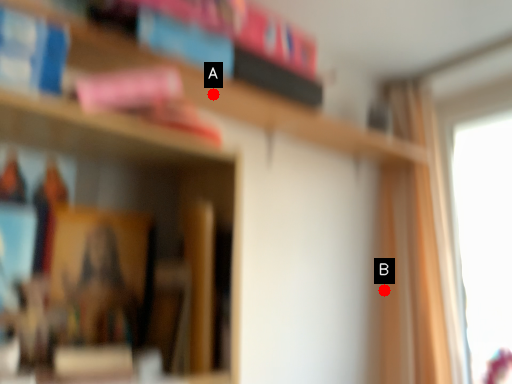
Question: Two points are circled on the image, labeled by A and B beside each circle. Which of the following is the closest to the observer?

Choices:
 (A) A is closer
 (B) B is closer

Answer: (A)